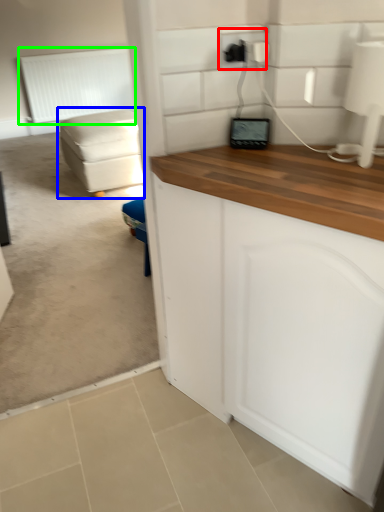
Question: Based on their relative distances, which object is nearer to electric outlet (highlighted by a red box)? Choose from studio couch (highlighted by a blue box) and radiator (highlighted by a green box).

Choices:
 (A) studio couch
 (B) radiator

Answer: (A)